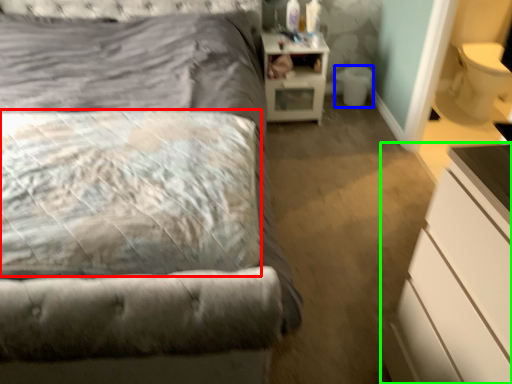
Question: Which object is the farthest from pillow (highlighted by a red box)? Choose among these: toilet bowl (highlighted by a blue box) or chest of drawers (highlighted by a green box).

Choices:
 (A) toilet bowl
 (B) chest of drawers

Answer: (A)